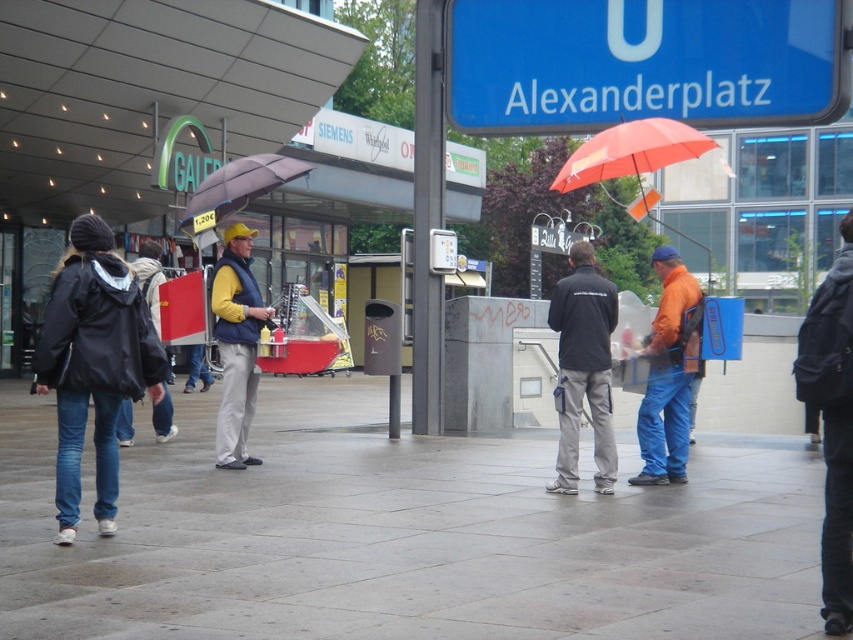
Question: Is blue plastic sign at upper center further to camera compared to black jacket at left?

Choices:
 (A) yes
 (B) no

Answer: (A)

Question: Which point is farther to the camera?

Choices:
 (A) black jacket at left
 (B) orange fabric backpack at center
 (C) yellow sweater at center
 (D) matte black jacket at left

Answer: (A)

Question: Which of the following is the closest to the observer?

Choices:
 (A) matte purple umbrella at center
 (B) gray concrete pavement at center
 (C) black jacket at left

Answer: (B)

Question: Can you confirm if blue plastic sign at upper center is bigger than matte purple umbrella at center?

Choices:
 (A) no
 (B) yes

Answer: (B)

Question: Which is nearer to the black fabric jacket at center?

Choices:
 (A) matte black jacket at left
 (B) black backpack at lower right
 (C) orange fabric backpack at center

Answer: (C)

Question: Is blue plastic sign at upper center behind matte black jacket at left?

Choices:
 (A) yes
 (B) no

Answer: (A)